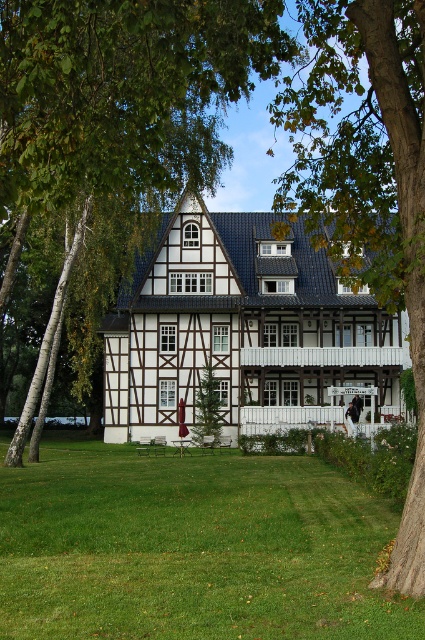
Is green grass lawn at center above smooth bark tree at center?

Incorrect, green grass lawn at center is not positioned above smooth bark tree at center.

Is point (184, 627) closer to viewer compared to point (422, 380)?

Yes, point (184, 627) is in front of point (422, 380).

Which is behind, point (153, 637) or point (354, 19)?

Point (354, 19)

What are the coordinates of `green grass lawn at center` in the screenshot? It's located at coord(192,548).

Does green grass lawn at center have a lesser height compared to green leafy tree at center?

Indeed, green grass lawn at center has a lesser height compared to green leafy tree at center.

In the scene shown: Can you confirm if green grass lawn at center is positioned to the right of green leafy tree at center?

Yes, green grass lawn at center is to the right of green leafy tree at center.

Where is `green grass lawn at center`? green grass lawn at center is located at coordinates (192, 548).

Is green leafy tree at center below smooth bark tree at center?

Indeed, green leafy tree at center is positioned under smooth bark tree at center.

Based on the photo, can you confirm if green leafy tree at center is taller than smooth bark tree at center?

Incorrect, green leafy tree at center's height is not larger of smooth bark tree at center's.

This screenshot has height=640, width=425. I want to click on green leafy tree at center, so click(119, 106).

I want to click on green leafy tree at center, so click(119, 106).